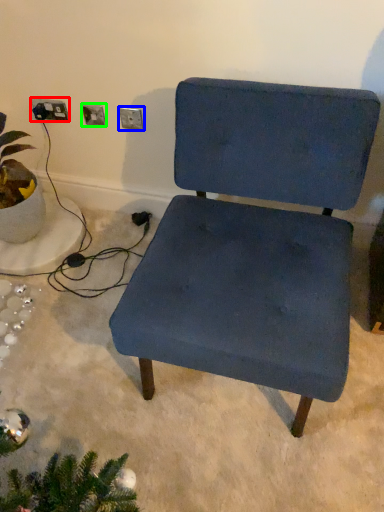
Question: Considering the real-world distances, which object is closest to electric outlet (highlighted by a red box)? electric outlet (highlighted by a blue box) or electric outlet (highlighted by a green box).

Choices:
 (A) electric outlet
 (B) electric outlet

Answer: (B)